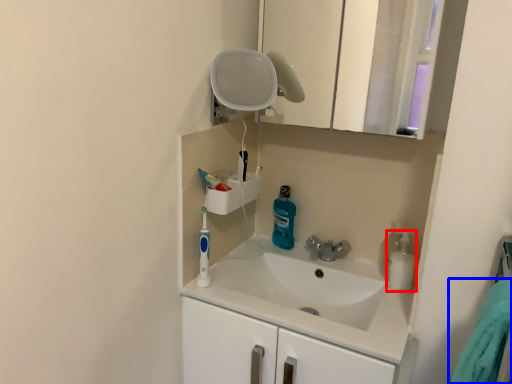
Question: Among these objects, which one is farthest to the camera, cleaning product (highlighted by a red box) or bath towel (highlighted by a blue box)?

Choices:
 (A) cleaning product
 (B) bath towel

Answer: (A)